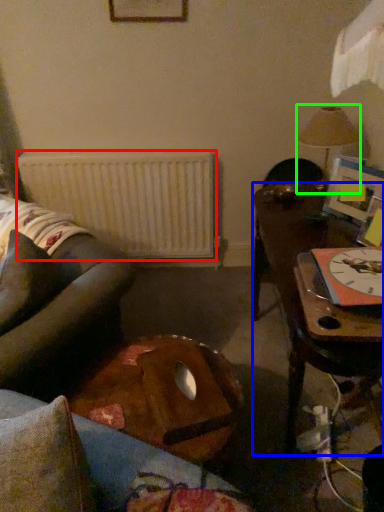
Question: Estimate the real-world distances between objects in this image. Which object is farther from radiator (highlighted by a red box), table (highlighted by a blue box) or lamp (highlighted by a green box)?

Choices:
 (A) table
 (B) lamp

Answer: (B)